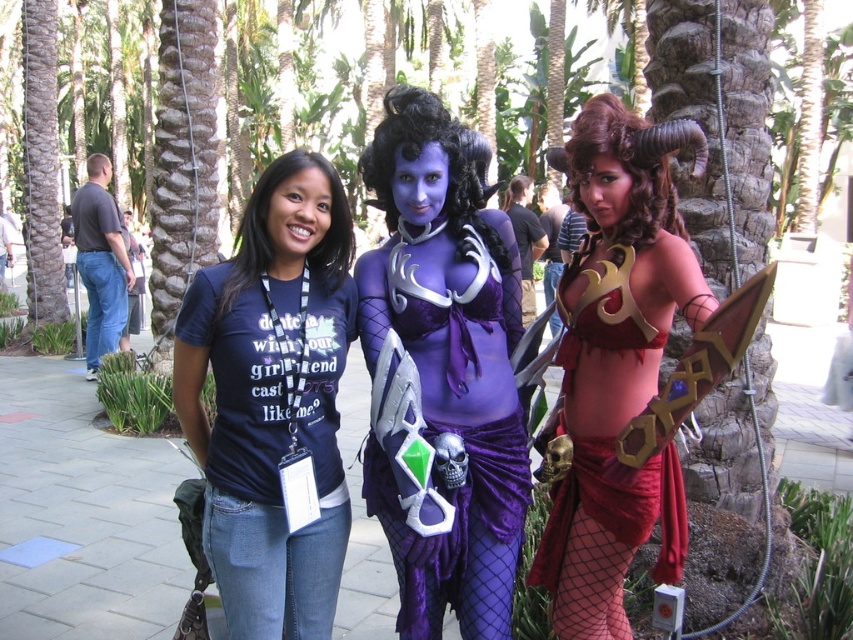
Looking at this image, which is above, matte blue t-shirt at center or purple velvet dress at center?

Positioned higher is matte blue t-shirt at center.

Is matte blue t-shirt at center closer to camera compared to purple velvet dress at center?

Yes.

Does point (276, 365) come closer to viewer compared to point (401, 536)?

Yes.

Locate an element on the screen. The width and height of the screenshot is (853, 640). matte blue t-shirt at center is located at coordinates (271, 397).

Which is above, matte purple armor at center or purple velvet dress at center?

matte purple armor at center

Is matte purple armor at center below purple velvet dress at center?

Actually, matte purple armor at center is above purple velvet dress at center.

Describe the element at coordinates (616, 364) in the screenshot. I see `matte purple armor at center` at that location.

Where is `matte purple armor at center`? This screenshot has height=640, width=853. matte purple armor at center is located at coordinates (616, 364).

Which is behind, point (315, 260) or point (685, 300)?

Point (315, 260)

Measure the distance between matte blue t-shirt at center and camera.

matte blue t-shirt at center and camera are 7.41 feet apart.

Identify the location of matte blue t-shirt at center. (271, 397).